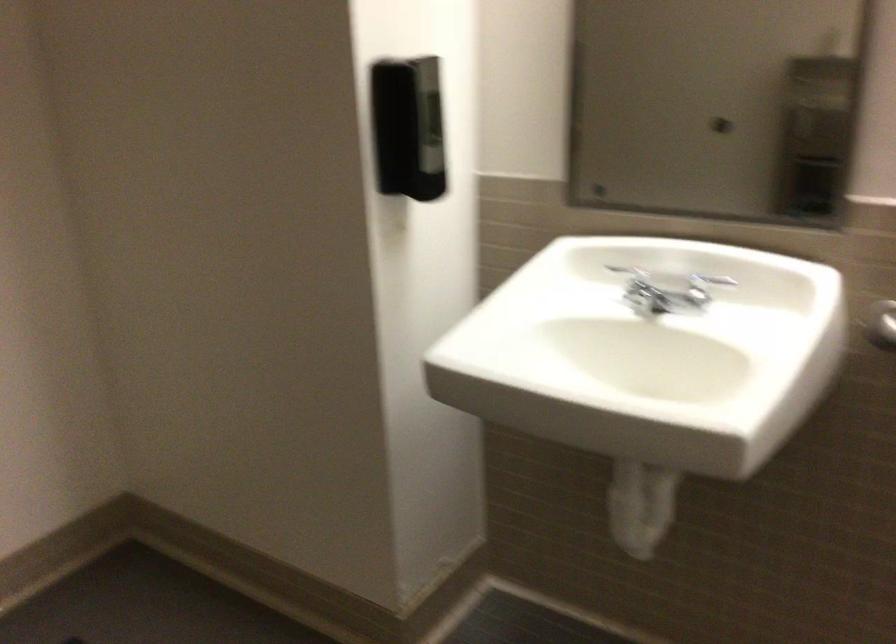
This screenshot has width=896, height=644. I want to click on black soap dispenser, so click(408, 128).